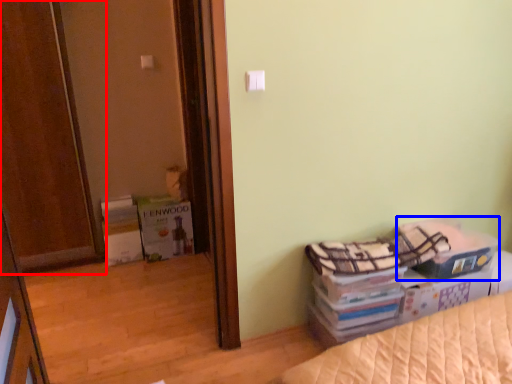
Question: Which object appears closest to the camera in this image, door (highlighted by a red box) or storage box (highlighted by a blue box)?

Choices:
 (A) door
 (B) storage box

Answer: (A)